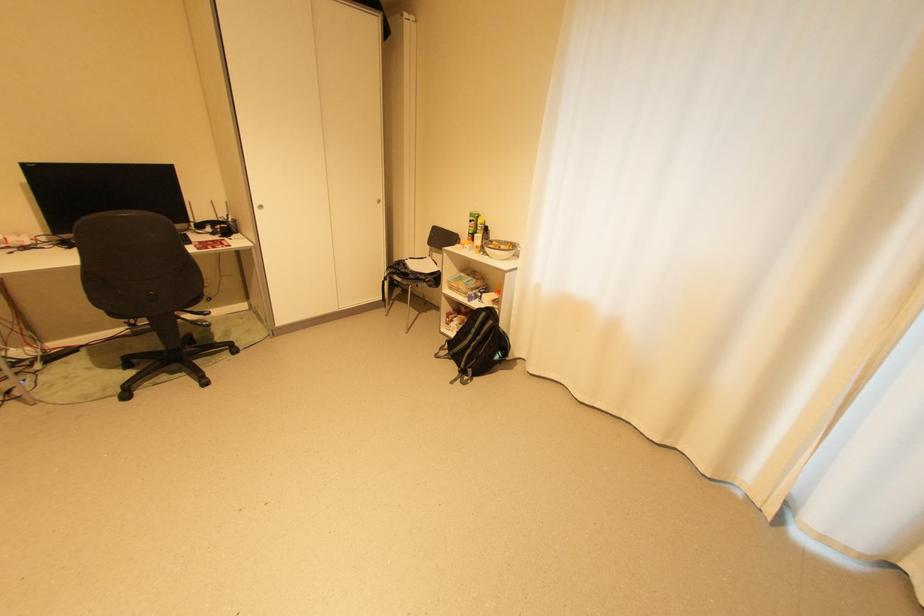
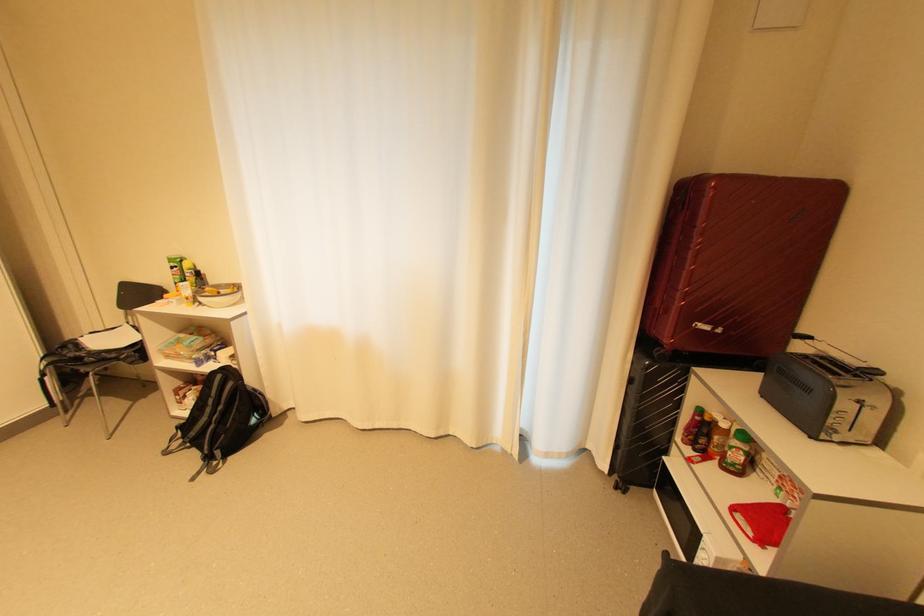
Where in the second image is the point corresponding to [480,223] from the first image?

(184, 270)